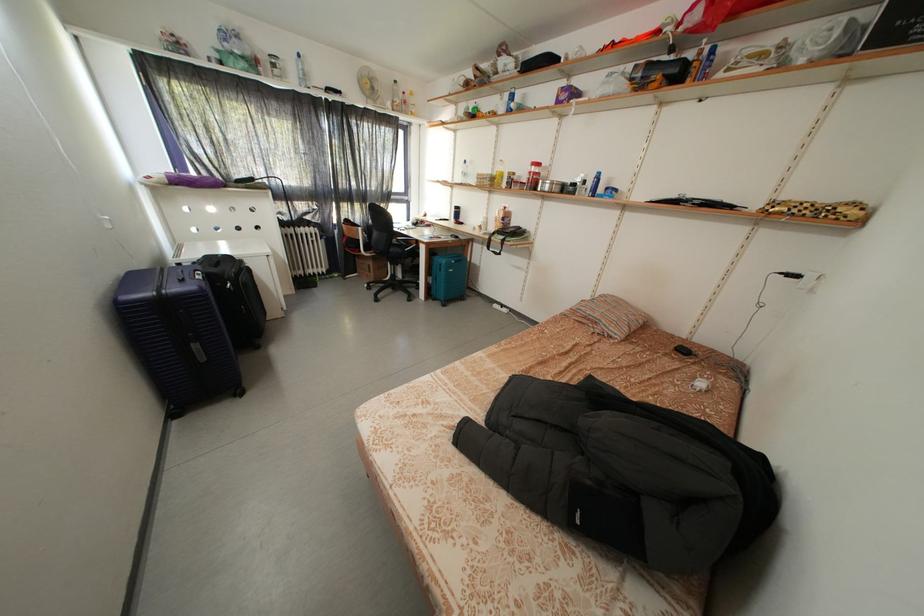
Where would you sit the chair sitting surface? Please return your answer as a coordinate pair (x, y).

(403, 248)